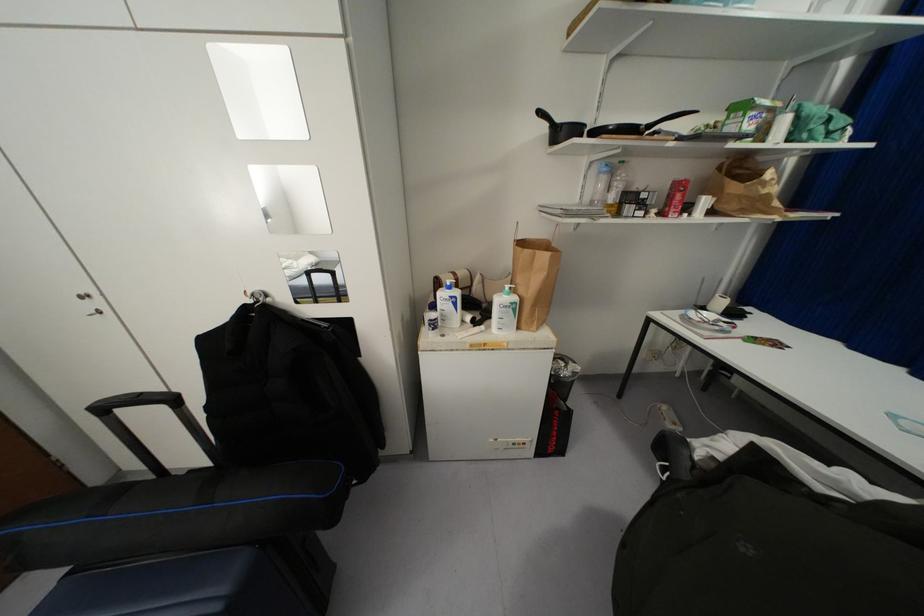
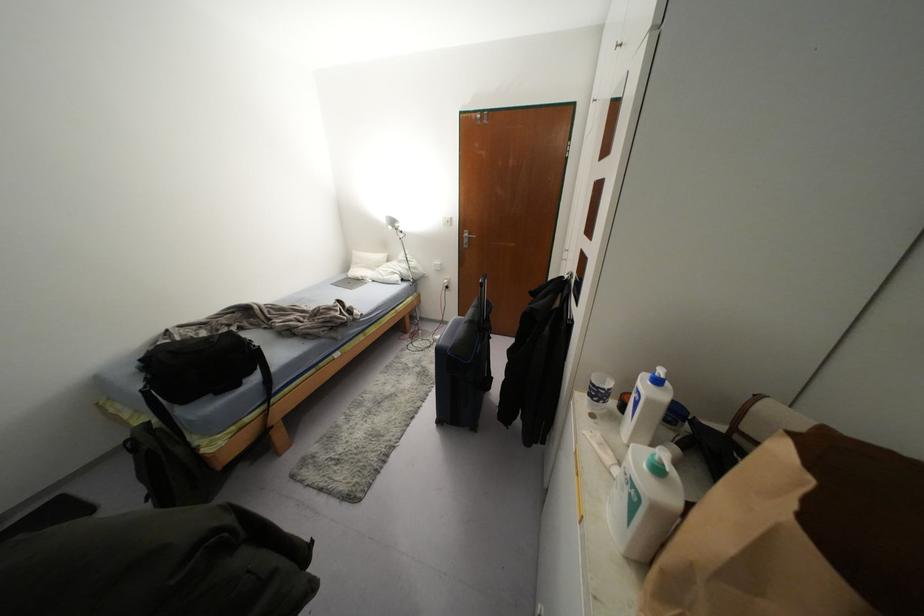
The first image is from the beginning of the video and the second image is from the end. How did the camera likely rotate when shooting the video?

The camera's rotation is toward left-down.